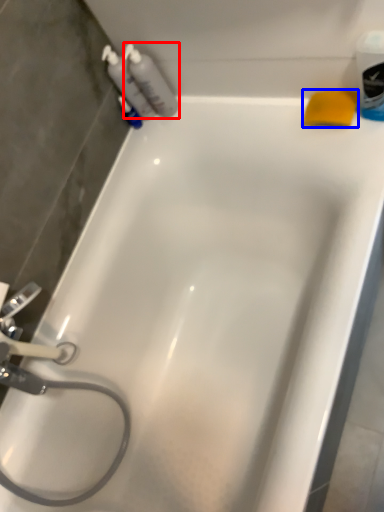
Question: Which object appears farthest to the camera in this image, cleaning product (highlighted by a red box) or soap (highlighted by a blue box)?

Choices:
 (A) cleaning product
 (B) soap

Answer: (A)